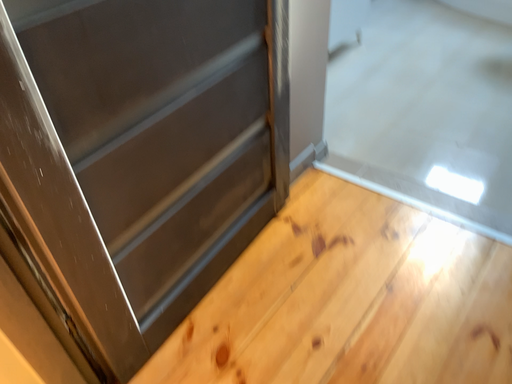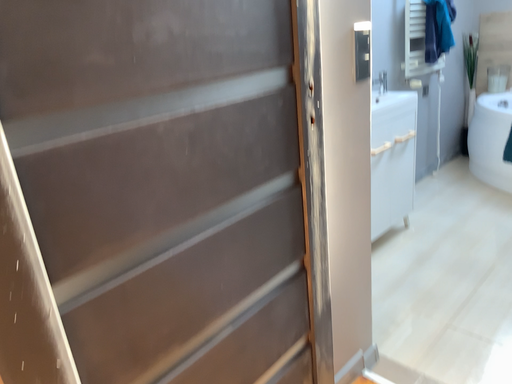
Question: Which way did the camera rotate in the video?

Choices:
 (A) rotated downward
 (B) rotated upward

Answer: (B)